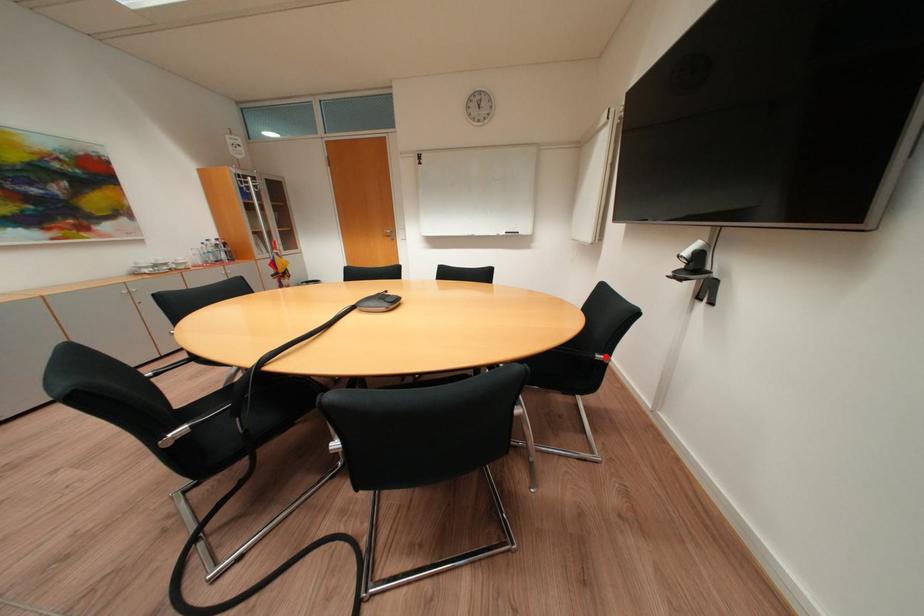
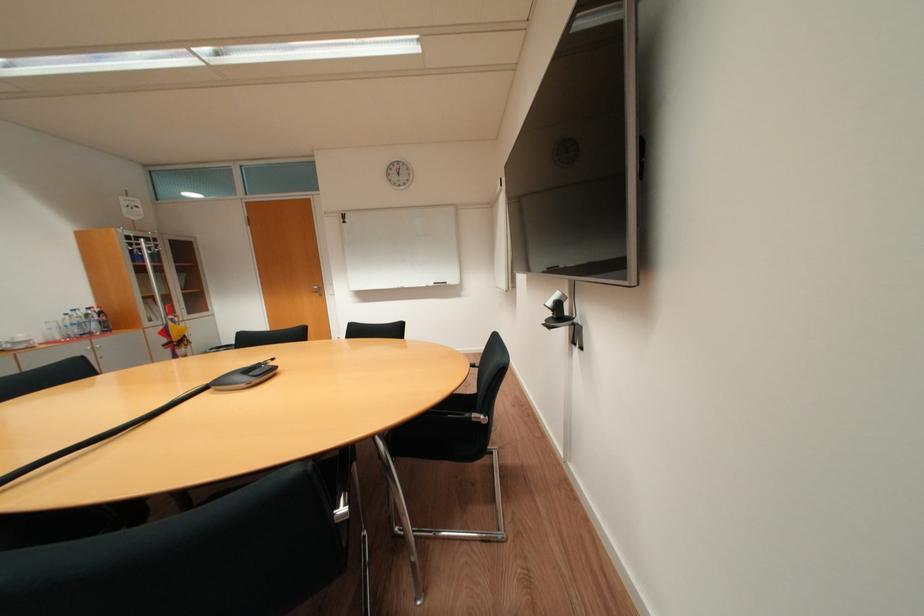
Question: I am providing you with two images of the same scene from different viewpoints. Image1 has a red point marked. In image2, the corresponding 3D location appears at what relative position? Reply with the corresponding letter.

Choices:
 (A) Closer
 (B) Farther

Answer: (A)